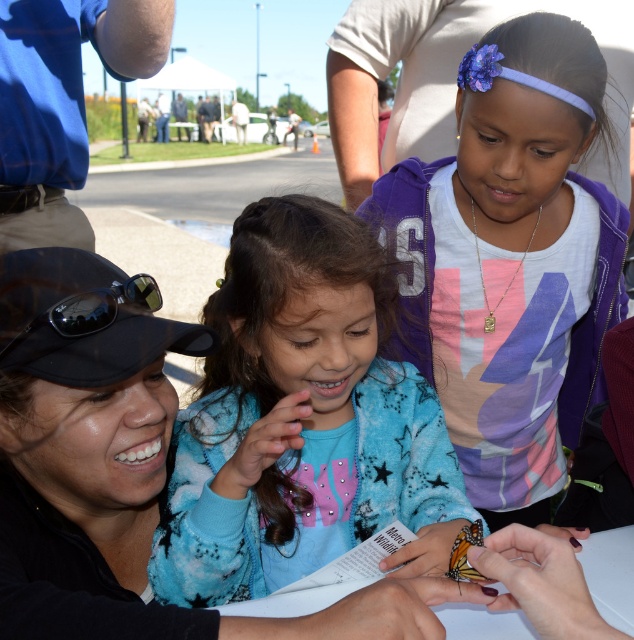
Between blue fleece jacket at center and white cotton shirt at upper center, which one has less height?

With less height is blue fleece jacket at center.

Is blue fleece jacket at center further to camera compared to white cotton shirt at upper center?

No, blue fleece jacket at center is in front of white cotton shirt at upper center.

Locate an element on the screen. The height and width of the screenshot is (640, 634). blue fleece jacket at center is located at coordinates (302, 419).

Which is behind, point (204, 442) or point (153, 70)?

Point (153, 70)

Find the location of `blue fleece jacket at center`. blue fleece jacket at center is located at coordinates (302, 419).

Measure the distance between point (527, 269) and camera.

Point (527, 269) and camera are 1.48 meters apart.

Does purple cotton hoodie at upper right have a greater height compared to blue shirt at upper left?

Correct, purple cotton hoodie at upper right is much taller as blue shirt at upper left.

Between point (555, 118) and point (119, 13), which one is positioned behind?

Point (119, 13)

The image size is (634, 640). Find the location of `purple cotton hoodie at upper right`. purple cotton hoodie at upper right is located at coordinates (510, 260).